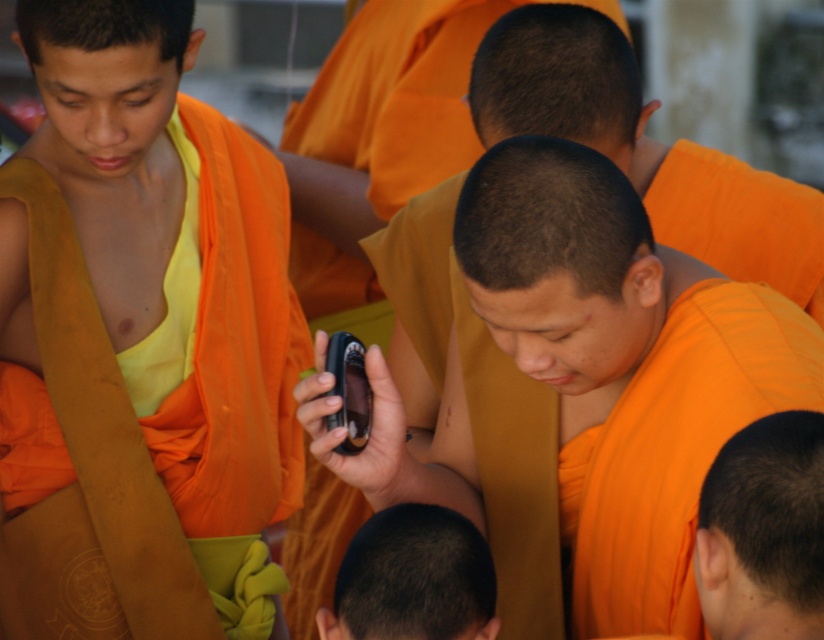
Question: Does matte orange robe at left have a lesser width compared to shiny orange monk at center?

Choices:
 (A) yes
 (B) no

Answer: (B)

Question: Can you confirm if shiny orange monk at center is positioned above dark brown hair at center?

Choices:
 (A) yes
 (B) no

Answer: (A)

Question: Can you confirm if matte orange robe at left is positioned to the left of matte orange monk at center?

Choices:
 (A) no
 (B) yes

Answer: (B)

Question: Among these points, which one is nearest to the camera?

Choices:
 (A) pos(612,573)
 (B) pos(68,410)
 (C) pos(443,636)

Answer: (C)

Question: Which object appears closest to the camera in this image?

Choices:
 (A) dark brown hair at center
 (B) matte orange monk at center

Answer: (B)

Question: Which object is farther from the camera taking this photo?

Choices:
 (A) matte orange monk at center
 (B) shiny orange monk at center

Answer: (A)